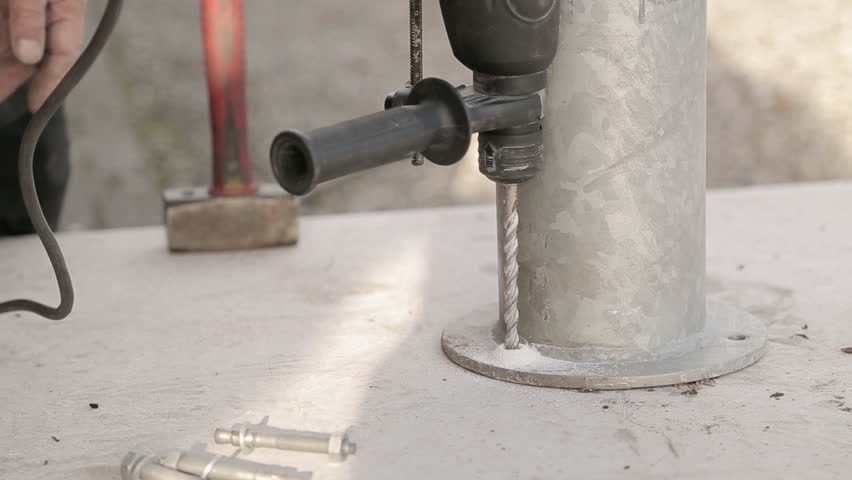
The width and height of the screenshot is (852, 480). I want to click on wall, so click(x=787, y=68).